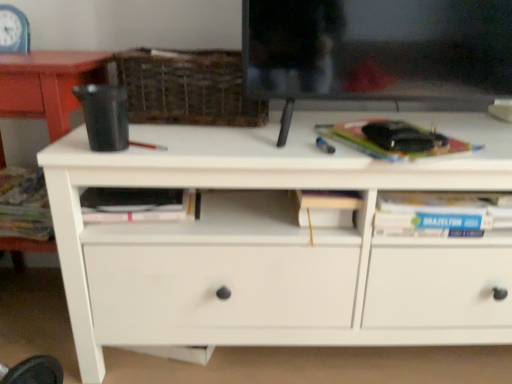
Locate an element on the screen. spots to the right of hardcover book at right, which is counted as the 1th paperback book, starting from the right is located at coordinates (480, 139).